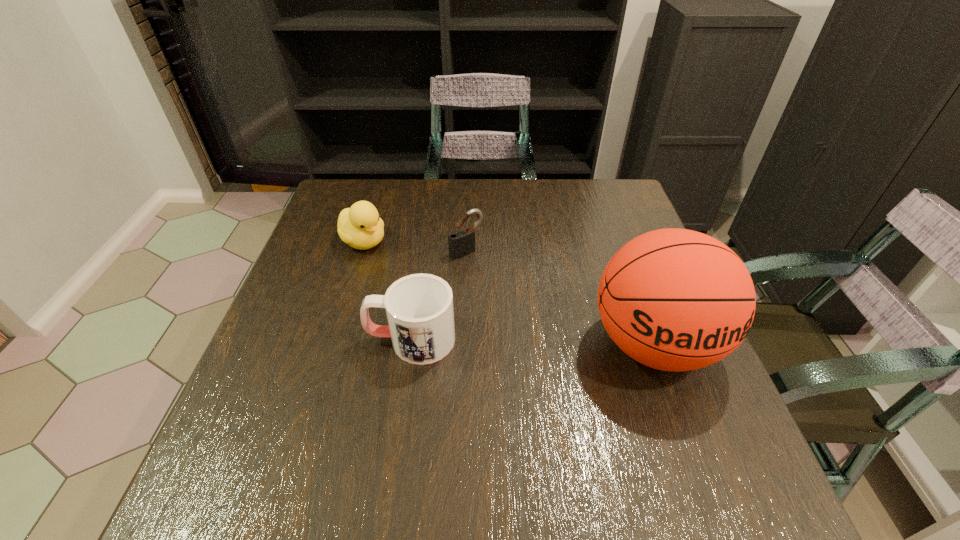
Where is `free space on the desktop that is between the mug and the rightmost object and is positioned on the front-facing side of the leftmost object`? Image resolution: width=960 pixels, height=540 pixels. free space on the desktop that is between the mug and the rightmost object and is positioned on the front-facing side of the leftmost object is located at coordinates (508, 341).

You are a GUI agent. You are given a task and a screenshot of the screen. Output one action in this format:
    pyautogui.click(x=<x>, y=<y>)
    Task: Click on the free spot on the desktop that is between the mug and the rightmost object and is positioned with the keyhole on the front of the padlock
    The height and width of the screenshot is (540, 960).
    Given the screenshot: What is the action you would take?
    pyautogui.click(x=554, y=342)